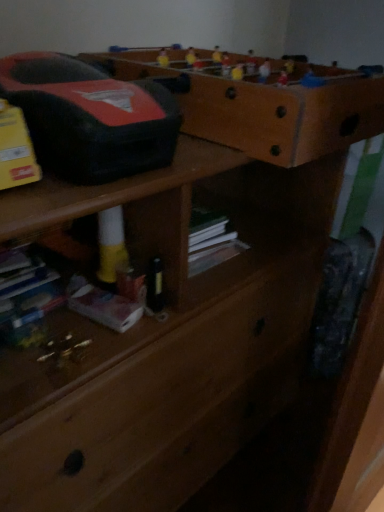
Question: Considering the positions of point (296, 155) and point (188, 193), is point (296, 155) closer or farther from the camera than point (188, 193)?

Choices:
 (A) closer
 (B) farther

Answer: (B)

Question: Considering the positions of brown wooden shelf at upper center and wooden chest of drawers at center in the image, is brown wooden shelf at upper center wider or thinner than wooden chest of drawers at center?

Choices:
 (A) wide
 (B) thin

Answer: (A)

Question: Which is nearer to the brown wooden shelf at upper center?

Choices:
 (A) wooden chest of drawers at center
 (B) white matte book at lower left

Answer: (A)

Question: Estimate the real-world distances between objects in this image. Which object is closer to the white matte book at lower left?

Choices:
 (A) wooden chest of drawers at center
 (B) brown wooden shelf at upper center

Answer: (A)